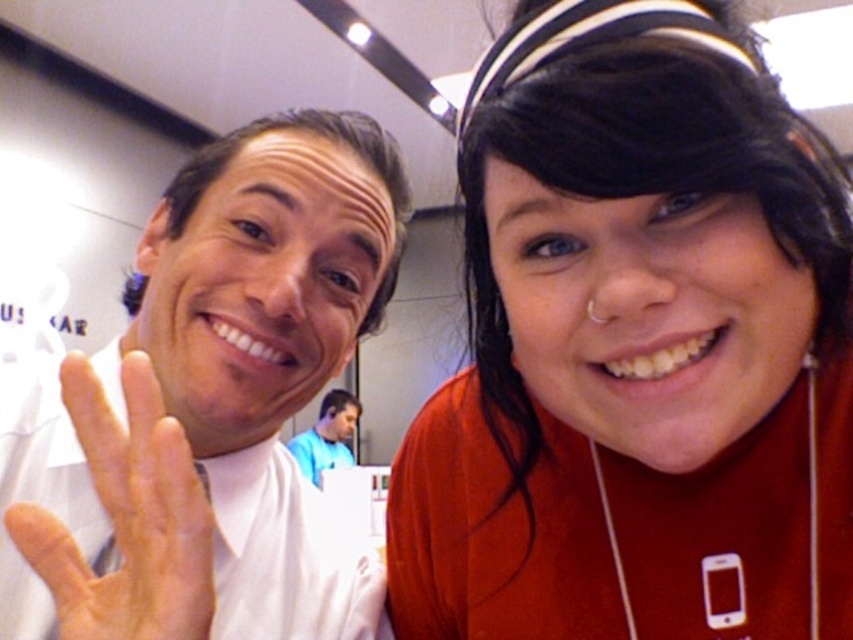
Question: Which point is farther to the camera?

Choices:
 (A) silver metallic earphone at upper right
 (B) white matte t-shirt at left

Answer: (A)

Question: Is the position of white matte t-shirt at left more distant than that of silver metallic earphone at upper right?

Choices:
 (A) yes
 (B) no

Answer: (B)

Question: Can you confirm if white matte hand at center is positioned to the left of silver metallic earphone at upper right?

Choices:
 (A) yes
 (B) no

Answer: (A)

Question: Among these objects, which one is nearest to the camera?

Choices:
 (A) white matte t-shirt at left
 (B) white matte hand at center
 (C) blue fabric shirt at center
 (D) silver metallic earphone at upper right

Answer: (B)

Question: Can you confirm if blue fabric shirt at center is positioned below silver metallic earphone at upper right?

Choices:
 (A) yes
 (B) no

Answer: (A)

Question: Which point appears farthest from the camera in this image?

Choices:
 (A) (598, 321)
 (B) (334, 408)
 (C) (352, 204)
 (D) (90, 481)

Answer: (B)